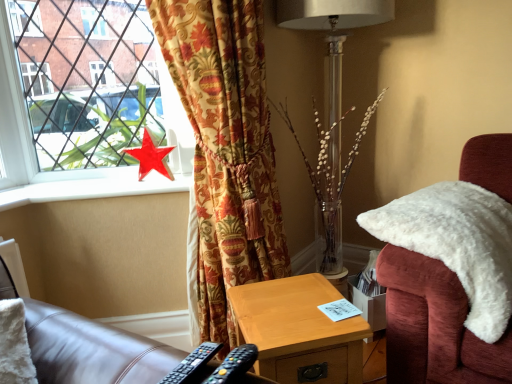
Question: Does black plastic remote control at lower center, which appears as the 2th remote control when viewed from the left, appear on the right side of metallic silver table lamp at center?

Choices:
 (A) no
 (B) yes

Answer: (A)

Question: Is black plastic remote control at lower center, arranged as the first remote control when viewed from the right, facing away from metallic silver table lamp at center?

Choices:
 (A) yes
 (B) no

Answer: (B)

Question: Is black plastic remote control at lower center, arranged as the first remote control when viewed from the right, in front of metallic silver table lamp at center?

Choices:
 (A) no
 (B) yes

Answer: (B)

Question: From a real-world perspective, does black plastic remote control at lower center, arranged as the first remote control when viewed from the right, stand above metallic silver table lamp at center?

Choices:
 (A) yes
 (B) no

Answer: (B)

Question: From the image's perspective, is black plastic remote control at lower center, arranged as the first remote control when viewed from the right, over metallic silver table lamp at center?

Choices:
 (A) yes
 (B) no

Answer: (B)

Question: Is black plastic remote control at lower center, arranged as the first remote control when viewed from the right, bigger than metallic silver table lamp at center?

Choices:
 (A) yes
 (B) no

Answer: (B)

Question: Is white smooth window sill at upper left facing away from red glossy star at window?

Choices:
 (A) yes
 (B) no

Answer: (B)

Question: Is white smooth window sill at upper left taller than red glossy star at window?

Choices:
 (A) yes
 (B) no

Answer: (B)

Question: Does white smooth window sill at upper left have a lesser width compared to red glossy star at window?

Choices:
 (A) no
 (B) yes

Answer: (A)

Question: Is white smooth window sill at upper left next to red glossy star at window and touching it?

Choices:
 (A) no
 (B) yes

Answer: (A)

Question: Does white smooth window sill at upper left appear on the left side of red glossy star at window?

Choices:
 (A) yes
 (B) no

Answer: (A)

Question: From a real-world perspective, is white smooth window sill at upper left beneath red glossy star at window?

Choices:
 (A) no
 (B) yes

Answer: (B)

Question: From a real-world perspective, is velvet floral curtain at left on black plastic remote control at lower center, which appears as the 2th remote control when viewed from the left?

Choices:
 (A) no
 (B) yes

Answer: (B)